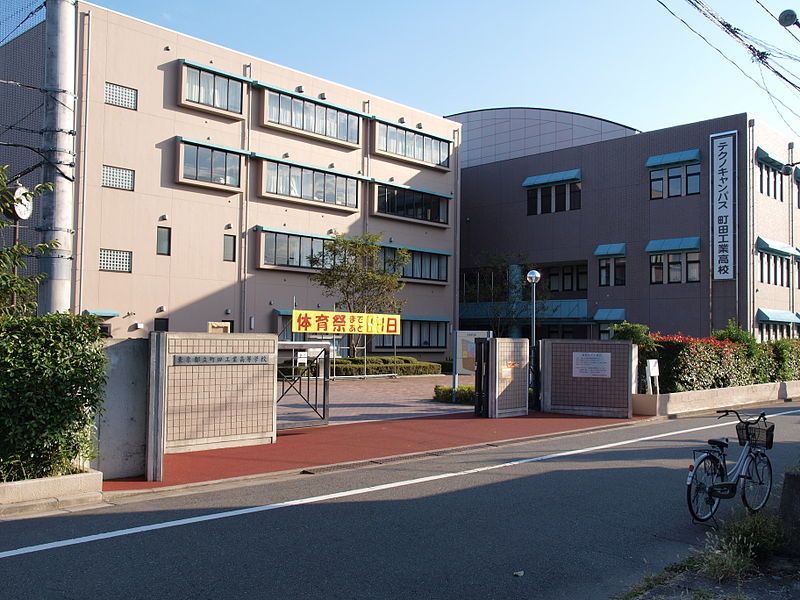
Where is `walls`? walls is located at coordinates (594, 387), (498, 394), (233, 406), (156, 429).